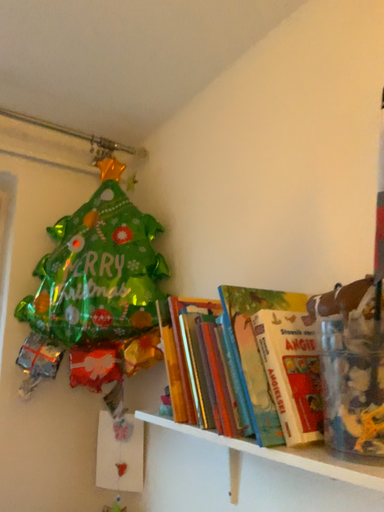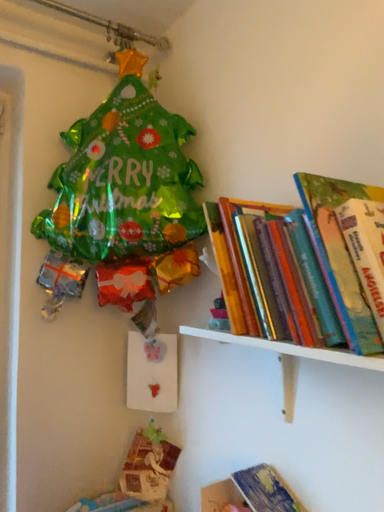
Question: Which way did the camera rotate in the video?

Choices:
 (A) rotated upward
 (B) rotated downward

Answer: (B)